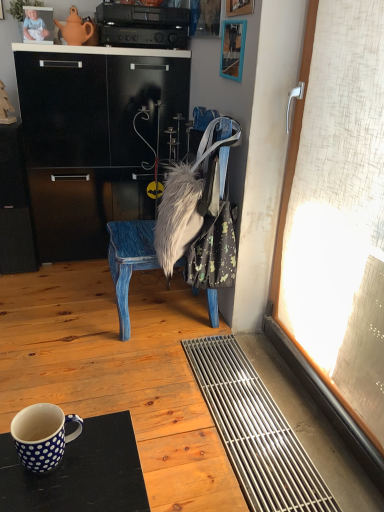
What is the approximate width of matte clay teapot at upper left?

3.37 inches.

The width and height of the screenshot is (384, 512). Identify the location of matte clay teapot at upper left. (75, 29).

Image resolution: width=384 pixels, height=512 pixels. What do you see at coordinates (1, 10) in the screenshot?
I see `brushed metal picture frame at upper center, which ranks as the 1th picture frame in top-to-bottom order` at bounding box center [1, 10].

What is the approximate width of black plastic stereo at upper center?

The width of black plastic stereo at upper center is 14.65 inches.

Locate an element on the screen. This screenshot has height=512, width=384. fuzzy fabric bag at center is located at coordinates (192, 196).

This screenshot has height=512, width=384. In order to click on light blue fabric baby at upper left in this screenshot , I will do `click(34, 26)`.

What do you see at coordinates (34, 26) in the screenshot? This screenshot has width=384, height=512. I see `light blue fabric baby at upper left` at bounding box center [34, 26].

Describe the element at coordinates (239, 7) in the screenshot. I see `wooden picture frame at upper center, the 1th picture frame when ordered from front to back` at that location.

The image size is (384, 512). I want to click on matte clay teapot at upper left, so click(x=75, y=29).

This screenshot has width=384, height=512. Identify the location of fur that is below the light blue fabric baby at upper left (from the image's perspective). (178, 216).

Considering the positions of objects fuzzy white fur at center and light blue fabric baby at upper left in the image provided, who is more to the left, fuzzy white fur at center or light blue fabric baby at upper left?

light blue fabric baby at upper left.

Measure the distance between fuzzy white fur at center and light blue fabric baby at upper left.

fuzzy white fur at center is 1.23 meters away from light blue fabric baby at upper left.

Considering the positions of objects fuzzy white fur at center and light blue fabric baby at upper left in the image provided, who is behind, fuzzy white fur at center or light blue fabric baby at upper left?

Positioned behind is light blue fabric baby at upper left.

From the image's perspective, is wooden picture frame at upper right, the 2th picture frame from the left, above or below fuzzy fabric bag at center?

wooden picture frame at upper right, the 2th picture frame from the left, is situated higher than fuzzy fabric bag at center in the image.

Which is behind, wooden picture frame at upper right, the 2th picture frame when ordered from front to back, or fuzzy fabric bag at center?

wooden picture frame at upper right, the 2th picture frame when ordered from front to back, is further away from the camera.

At what (x,y) coordinates should I click in order to perform the action: click on handbag below the wooden picture frame at upper right, which is the third picture frame in top-to-bottom order (from a real-world perspective). Please return your answer as a coordinate pair (x, y). This screenshot has width=384, height=512. Looking at the image, I should click on (192, 196).

Which object is wider, wooden picture frame at upper right, arranged as the 2th picture frame when viewed from the right, or fuzzy fabric bag at center?

With larger width is fuzzy fabric bag at center.

Does brushed metal picture frame at upper center, placed as the third picture frame when sorted from front to back, appear on the right side of fuzzy white fur at center?

No.

Is brushed metal picture frame at upper center, the first picture frame in the left-to-right sequence, not near fuzzy white fur at center?

brushed metal picture frame at upper center, the first picture frame in the left-to-right sequence, is far away from fuzzy white fur at center.

Is brushed metal picture frame at upper center, placed as the third picture frame when sorted from front to back, smaller than fuzzy white fur at center?

Yes, brushed metal picture frame at upper center, placed as the third picture frame when sorted from front to back, is smaller than fuzzy white fur at center.

From the image's perspective, between fuzzy white fur at center and fuzzy fabric bag at center, which one is located above?

fuzzy fabric bag at center, from the image's perspective.

Is fuzzy white fur at center turned away from fuzzy fabric bag at center?

That's right, fuzzy white fur at center is facing away from fuzzy fabric bag at center.

Is point (166, 193) positioned in front of point (224, 136)?

That is False.

From a real-world perspective, is black plastic stereo at upper center positioned under light blue fabric baby at upper left based on gravity?

Actually, black plastic stereo at upper center is physically above light blue fabric baby at upper left in the real world.

Is black plastic stereo at upper center surrounding light blue fabric baby at upper left?

Definitely not — light blue fabric baby at upper left is not inside black plastic stereo at upper center.

The height and width of the screenshot is (512, 384). In the image, there is a black plastic stereo at upper center. Identify the location of person below it (from a real-world perspective). (34, 26).

Considering the sizes of objects black plastic stereo at upper center and light blue fabric baby at upper left in the image provided, who is wider, black plastic stereo at upper center or light blue fabric baby at upper left?

black plastic stereo at upper center.

Measure the distance between light blue fabric baby at upper left and wooden picture frame at upper center, which is the 2th picture frame from bottom to top.

light blue fabric baby at upper left is 1.02 meters from wooden picture frame at upper center, which is the 2th picture frame from bottom to top.

Can you confirm if light blue fabric baby at upper left is wider than wooden picture frame at upper center, the 2th picture frame from the top?

Yes, light blue fabric baby at upper left is wider than wooden picture frame at upper center, the 2th picture frame from the top.

Based on the photo, considering the relative sizes of light blue fabric baby at upper left and wooden picture frame at upper center, the 1th picture frame when ordered from front to back, in the image provided, is light blue fabric baby at upper left taller than wooden picture frame at upper center, the 1th picture frame when ordered from front to back,?

No.

Is light blue fabric baby at upper left not within wooden picture frame at upper center, the third picture frame from the left?

light blue fabric baby at upper left lies outside wooden picture frame at upper center, the third picture frame from the left,'s area.

Which is more to the right, brushed metal picture frame at upper center, positioned as the 3th picture frame in bottom-to-top order, or black plastic stereo at upper center?

black plastic stereo at upper center is more to the right.

Which of these two, brushed metal picture frame at upper center, placed as the third picture frame when sorted from front to back, or black plastic stereo at upper center, is wider?

Wider between the two is black plastic stereo at upper center.

Is brushed metal picture frame at upper center, the 3th picture frame in the right-to-left sequence, taller or shorter than black plastic stereo at upper center?

Considering their sizes, brushed metal picture frame at upper center, the 3th picture frame in the right-to-left sequence, has more height than black plastic stereo at upper center.

Does brushed metal picture frame at upper center, placed as the third picture frame when sorted from front to back, turn towards black plastic stereo at upper center?

No, brushed metal picture frame at upper center, placed as the third picture frame when sorted from front to back, is not oriented towards black plastic stereo at upper center.

Identify the location of fur below the light blue fabric baby at upper left (from the image's perspective). This screenshot has height=512, width=384. (178, 216).

From a real-world perspective, which picture frame is the 1st one above the fuzzy fabric bag at center? Please provide its 2D coordinates.

[(233, 49)]

When comparing their distances from white polka dot ceramic mug at lower left, does brushed metal picture frame at upper center, which ranks as the 1th picture frame in top-to-bottom order, or light blue fabric baby at upper left seem closer?

light blue fabric baby at upper left is positioned closer to the anchor white polka dot ceramic mug at lower left.

Looking at the image, which one is located closer to wooden picture frame at upper center, the 2th picture frame from the top, blue painted wood chair at center or white polka dot ceramic mug at lower left?

blue painted wood chair at center is closer to wooden picture frame at upper center, the 2th picture frame from the top.

Consider the image. Looking at the image, which one is located further to white polka dot ceramic mug at lower left, matte clay teapot at upper left or blue painted wood chair at center?

matte clay teapot at upper left is positioned further to the anchor white polka dot ceramic mug at lower left.

Considering their positions, is fuzzy white fur at center positioned further to fuzzy fabric bag at center than blue painted wood chair at center?

blue painted wood chair at center is positioned further to the anchor fuzzy fabric bag at center.

Estimate the real-world distances between objects in this image. Which object is further from brushed metal picture frame at upper center, the 1th picture frame from the back, fuzzy white fur at center or blue painted wood chair at center?

blue painted wood chair at center is further to brushed metal picture frame at upper center, the 1th picture frame from the back.

Based on their spatial positions, is fuzzy white fur at center or black plastic stereo at upper center further from wooden picture frame at upper right, placed as the second picture frame when sorted from back to front?

fuzzy white fur at center is positioned further to the anchor wooden picture frame at upper right, placed as the second picture frame when sorted from back to front.

Based on the photo, when comparing their distances from wooden picture frame at upper right, placed as the second picture frame when sorted from back to front, does fuzzy fabric bag at center or matte clay teapot at upper left seem further?

The object further to wooden picture frame at upper right, placed as the second picture frame when sorted from back to front, is matte clay teapot at upper left.

Which object lies nearer to the anchor point wooden picture frame at upper center, which is the 2th picture frame from bottom to top, brushed metal picture frame at upper center, the 1th picture frame from the back, or blue painted wood chair at center?

blue painted wood chair at center.

Where is `teapot between brushed metal picture frame at upper center, the 3th picture frame in the right-to-left sequence, and fuzzy white fur at center from top to bottom`? teapot between brushed metal picture frame at upper center, the 3th picture frame in the right-to-left sequence, and fuzzy white fur at center from top to bottom is located at coordinates (75, 29).

I want to click on person between brushed metal picture frame at upper center, the first picture frame in the left-to-right sequence, and blue painted wood chair at center vertically, so point(34,26).

This screenshot has height=512, width=384. Find the location of `handbag between wooden picture frame at upper right, the first picture frame when ordered from bottom to top, and blue painted wood chair at center in the up-down direction`. handbag between wooden picture frame at upper right, the first picture frame when ordered from bottom to top, and blue painted wood chair at center in the up-down direction is located at coordinates (192, 196).

You are a GUI agent. You are given a task and a screenshot of the screen. Output one action in this format:
    pyautogui.click(x=<x>, y=<y>)
    Task: Click on the teapot located between brushed metal picture frame at upper center, which ranks as the 1th picture frame in top-to-bottom order, and wooden picture frame at upper right, which is the third picture frame in top-to-bottom order, in the left-right direction
    The image size is (384, 512).
    Given the screenshot: What is the action you would take?
    pyautogui.click(x=75, y=29)